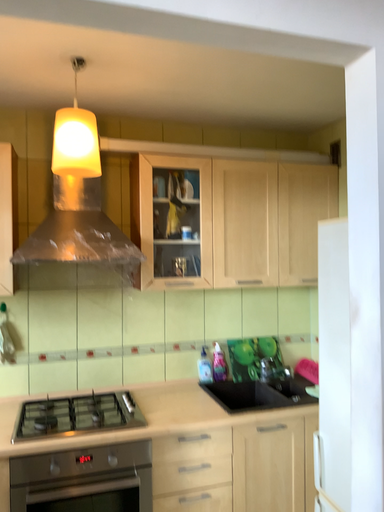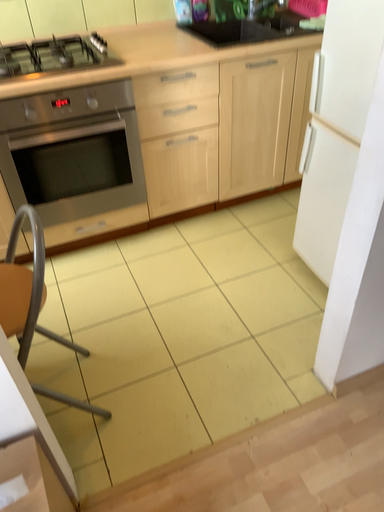
Question: How did the camera likely rotate when shooting the video?

Choices:
 (A) rotated downward
 (B) rotated upward

Answer: (A)